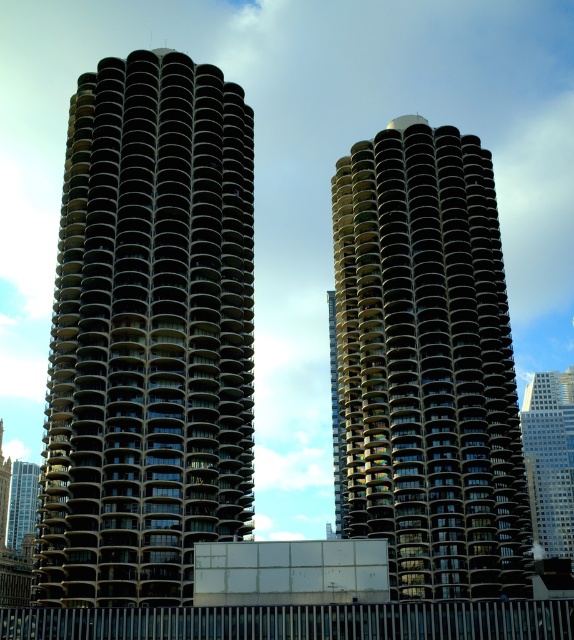
Question: Is the position of glassy reflective skyscraper at right less distant than that of matte glass building at left?

Choices:
 (A) yes
 (B) no

Answer: (B)

Question: Which object is the closest to the dark gray concrete building at left?

Choices:
 (A) matte glass building at left
 (B) glassy reflective skyscraper at right

Answer: (A)

Question: Which point is closer to the camera?

Choices:
 (A) glassy reflective skyscraper at right
 (B) black glass building at center
 (C) matte glass building at left
 (D) dark gray concrete building at left

Answer: (D)

Question: From the image, what is the correct spatial relationship of glassy reflective skyscraper at right in relation to matte glass building at left?

Choices:
 (A) above
 (B) below

Answer: (A)

Question: Where is black glass building at center located in relation to matte glass building at left in the image?

Choices:
 (A) above
 (B) below

Answer: (A)

Question: Among these points, which one is nearest to the camera?

Choices:
 (A) (9, 508)
 (B) (537, 403)
 (C) (470, 195)
 (D) (156, 236)

Answer: (D)